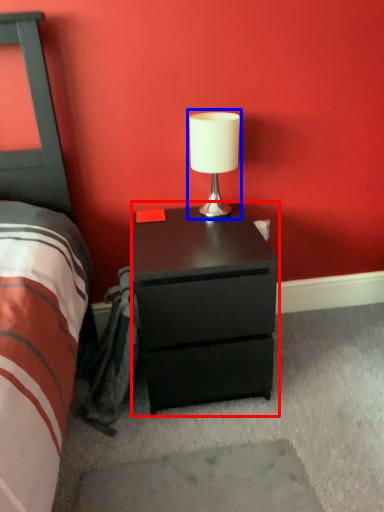
Question: Which of the following is the farthest to the observer, nightstand (highlighted by a red box) or table lamp (highlighted by a blue box)?

Choices:
 (A) nightstand
 (B) table lamp

Answer: (B)